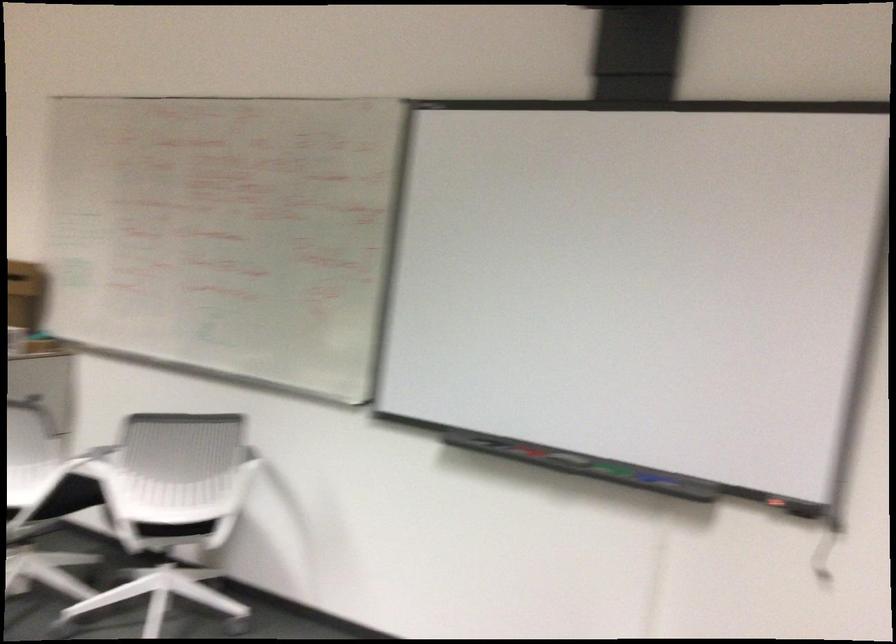
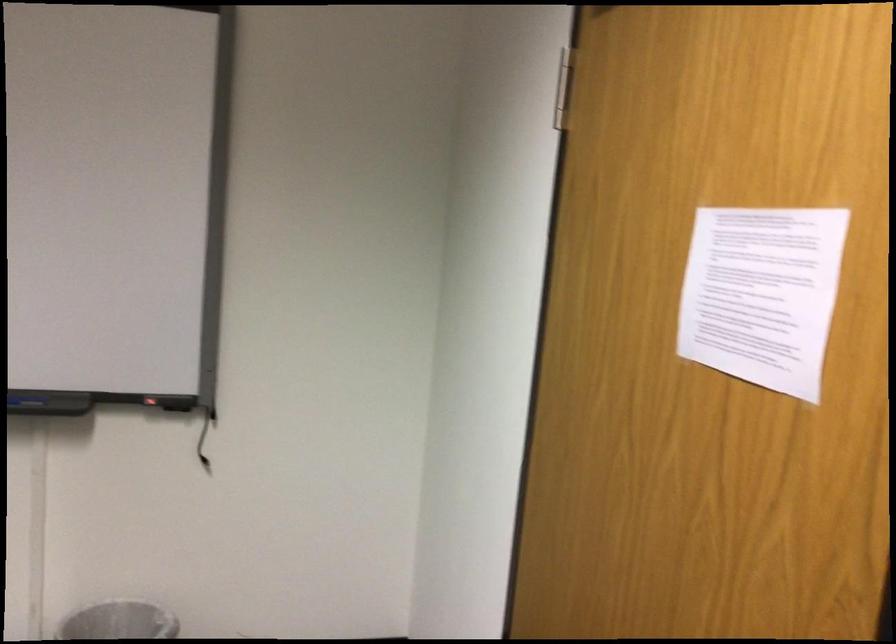
Question: The first image is from the beginning of the video and the second image is from the end. How did the camera likely rotate when shooting the video?

Choices:
 (A) Left
 (B) Right
 (C) Up
 (D) Down

Answer: (B)